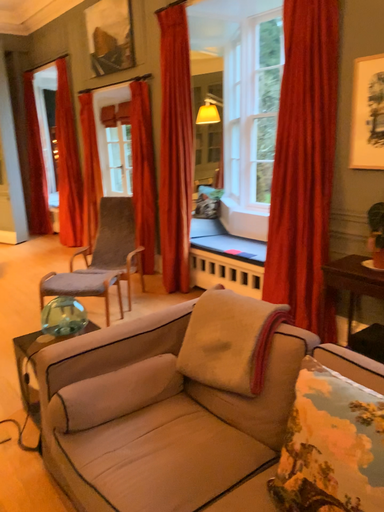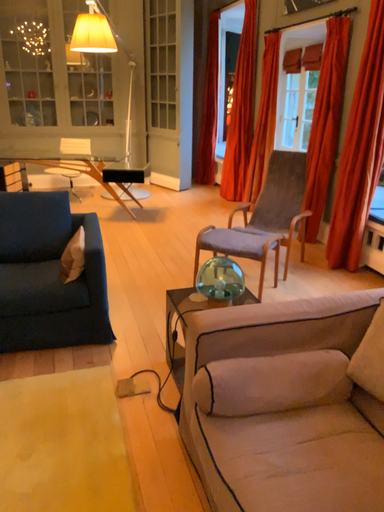
Question: Which way did the camera rotate in the video?

Choices:
 (A) rotated left
 (B) rotated right

Answer: (A)